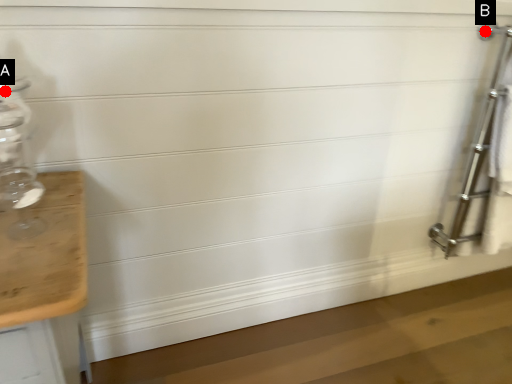
Question: Two points are circled on the image, labeled by A and B beside each circle. Which point is further to the camera?

Choices:
 (A) A is further
 (B) B is further

Answer: (B)